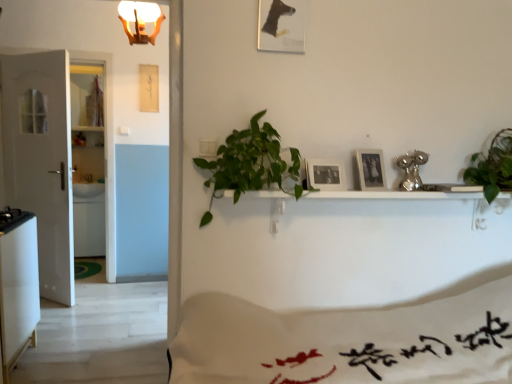
Question: Is white matte door at left bigger than matte paper picture frame at upper center, the third picture frame in the bottom-to-top sequence?

Choices:
 (A) no
 (B) yes

Answer: (B)

Question: Is white matte door at left thinner than matte paper picture frame at upper center, the first picture frame in the top-to-bottom sequence?

Choices:
 (A) yes
 (B) no

Answer: (B)

Question: Is white matte door at left surrounding matte paper picture frame at upper center, placed as the third picture frame when sorted from right to left?

Choices:
 (A) yes
 (B) no

Answer: (B)

Question: Considering the relative sizes of white matte door at left and matte paper picture frame at upper center, the third picture frame in the bottom-to-top sequence, in the image provided, is white matte door at left shorter than matte paper picture frame at upper center, the third picture frame in the bottom-to-top sequence,?

Choices:
 (A) yes
 (B) no

Answer: (B)

Question: Is white matte door at left with matte paper picture frame at upper center, the first picture frame in the top-to-bottom sequence?

Choices:
 (A) yes
 (B) no

Answer: (B)

Question: Is white matte door at left not near matte paper picture frame at upper center, the first picture frame in the top-to-bottom sequence?

Choices:
 (A) yes
 (B) no

Answer: (A)

Question: Is there a large distance between white glossy refrigerator at lower left and green leafy plant at center, arranged as the 2th houseplant when viewed from the right?

Choices:
 (A) no
 (B) yes

Answer: (B)

Question: Does white glossy refrigerator at lower left have a greater height compared to green leafy plant at center, the 1th houseplant in the left-to-right sequence?

Choices:
 (A) yes
 (B) no

Answer: (A)

Question: Is white glossy refrigerator at lower left with green leafy plant at center, arranged as the 2th houseplant when viewed from the right?

Choices:
 (A) yes
 (B) no

Answer: (B)

Question: Can you confirm if white glossy refrigerator at lower left is thinner than green leafy plant at center, the 1th houseplant in the left-to-right sequence?

Choices:
 (A) yes
 (B) no

Answer: (A)

Question: Can you confirm if white glossy refrigerator at lower left is positioned to the left of green leafy plant at center, arranged as the 2th houseplant when viewed from the right?

Choices:
 (A) yes
 (B) no

Answer: (A)

Question: Can you confirm if white glossy refrigerator at lower left is wider than green leafy plant at center, arranged as the 2th houseplant when viewed from the right?

Choices:
 (A) no
 (B) yes

Answer: (A)

Question: Is black matte picture frame at center, the 2th picture frame positioned from the right, smaller than white glossy refrigerator at lower left?

Choices:
 (A) no
 (B) yes

Answer: (B)